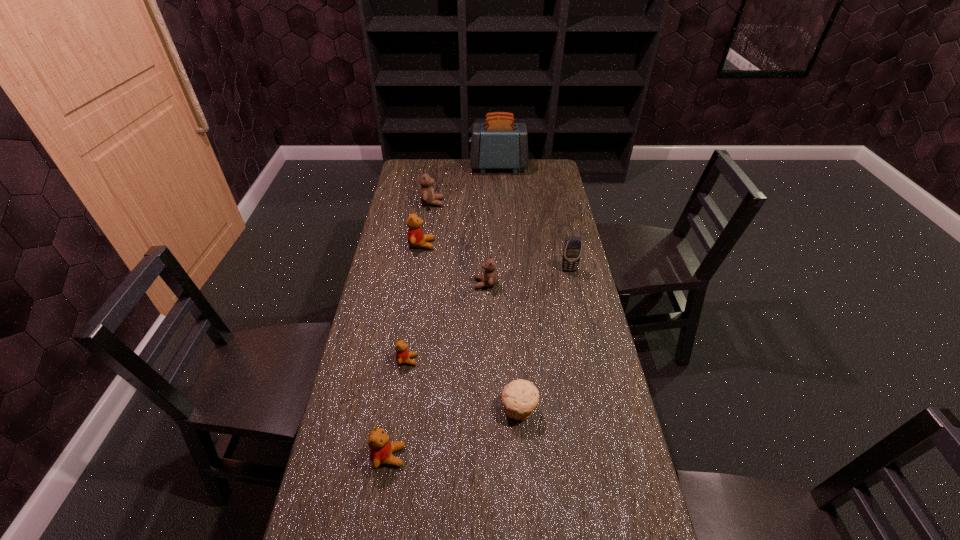
Locate an element on the screen. The height and width of the screenshot is (540, 960). vacant space located 0.390m on the front-facing side of the fourth nearest teddy bear is located at coordinates (535, 245).

Where is `blank space located 0.200m on the front face of the fourth farthest object`? This screenshot has height=540, width=960. blank space located 0.200m on the front face of the fourth farthest object is located at coordinates (579, 314).

You are a GUI agent. You are given a task and a screenshot of the screen. Output one action in this format:
    pyautogui.click(x=<x>, y=<y>)
    Task: Click on the free space located on the front-facing side of the nearest object
    The image size is (960, 540).
    Given the screenshot: What is the action you would take?
    pyautogui.click(x=513, y=456)

The image size is (960, 540). In order to click on free point located on the front-facing side of the rightmost teddy bear in this screenshot , I will do `click(460, 284)`.

At what (x,y) coordinates should I click in order to perform the action: click on free space located 0.130m on the front-facing side of the rightmost teddy bear. Please return your answer as a coordinate pair (x, y). Looking at the image, I should click on (437, 284).

Locate an element on the screen. This screenshot has width=960, height=540. free space located on the front-facing side of the rightmost teddy bear is located at coordinates (445, 284).

At what (x,y) coordinates should I click in order to perform the action: click on vacant position located on the left of the muffin. Please return your answer as a coordinate pair (x, y). Looking at the image, I should click on (442, 409).

Locate an element on the screen. vacant space positioned 0.290m on the front-facing side of the second farthest red teddy bear is located at coordinates (515, 360).

Where is `object that is at the far edge`? object that is at the far edge is located at coordinates (499, 143).

At what (x,y) coordinates should I click in order to perform the action: click on toaster present at the right edge. Please return your answer as a coordinate pair (x, y). This screenshot has height=540, width=960. Looking at the image, I should click on (499, 143).